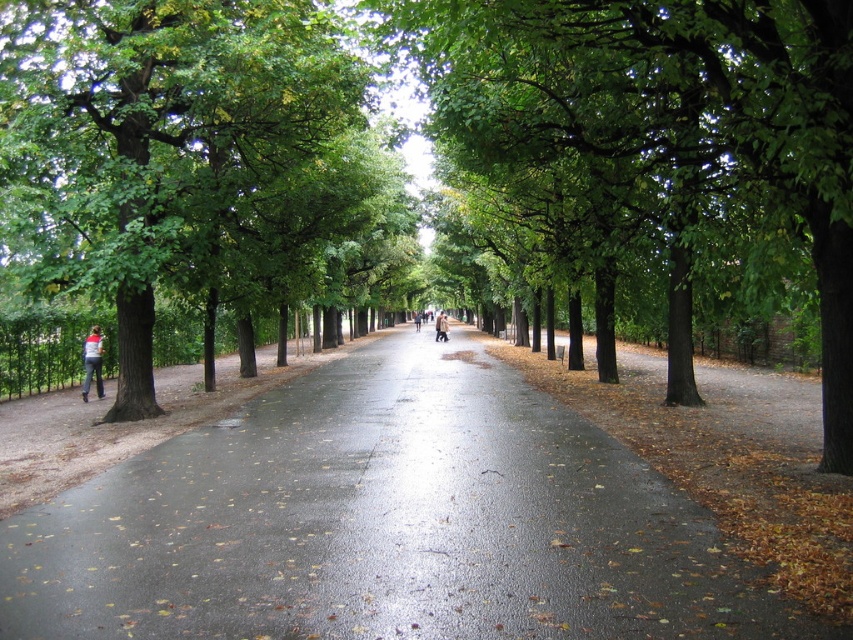
Which is below, shiny asphalt road at center or dark blue jeans at center?

shiny asphalt road at center is lower down.

Image resolution: width=853 pixels, height=640 pixels. In order to click on shiny asphalt road at center in this screenshot , I will do `click(384, 524)`.

Where is `shiny asphalt road at center`? shiny asphalt road at center is located at coordinates (384, 524).

Can you confirm if green leafy tree at left is positioned to the left of green leafy tree at center?

Indeed, green leafy tree at left is positioned on the left side of green leafy tree at center.

Which is above, green leafy tree at left or green leafy tree at center?

green leafy tree at center is above.

Find the location of a particular element. The image size is (853, 640). green leafy tree at left is located at coordinates (195, 168).

Is green leafy tree at center wider than dark blue jeans at center?

Correct, the width of green leafy tree at center exceeds that of dark blue jeans at center.

Does green leafy tree at center appear on the left side of dark blue jeans at center?

No, green leafy tree at center is not to the left of dark blue jeans at center.

You are a GUI agent. You are given a task and a screenshot of the screen. Output one action in this format:
    pyautogui.click(x=<x>, y=<y>)
    Task: Click on the green leafy tree at center
    The height and width of the screenshot is (640, 853).
    Given the screenshot: What is the action you would take?
    pyautogui.click(x=660, y=125)

Locate an element on the screen. green leafy tree at center is located at coordinates (660, 125).